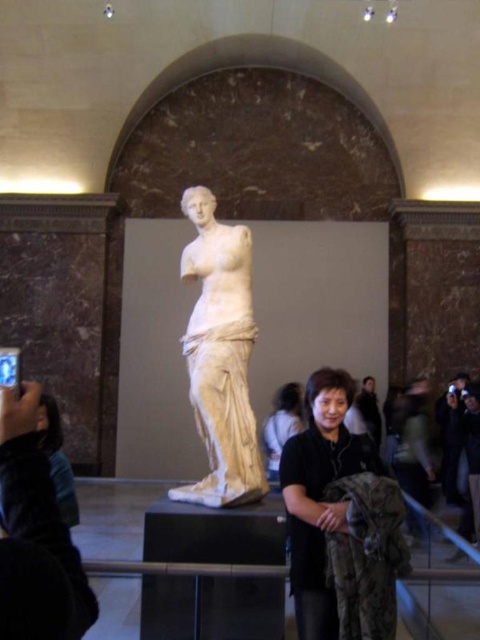
Which is below, dark green fabric at lower right or black matte jacket at center?

dark green fabric at lower right is below.

Is point (410, 406) positioned before point (360, 392)?

Yes, it is.

This screenshot has width=480, height=640. What do you see at coordinates (414, 444) in the screenshot? I see `dark green fabric at lower right` at bounding box center [414, 444].

The image size is (480, 640). In order to click on dark green fabric at lower right in this screenshot , I will do `click(414, 444)`.

Can you confirm if white marble statue at center is positioned to the right of matte black jacket at lower center?

In fact, white marble statue at center is to the left of matte black jacket at lower center.

Image resolution: width=480 pixels, height=640 pixels. Describe the element at coordinates (220, 356) in the screenshot. I see `white marble statue at center` at that location.

This screenshot has height=640, width=480. In order to click on white marble statue at center in this screenshot , I will do `click(220, 356)`.

The image size is (480, 640). Identify the location of white marble statue at center. pos(220,356).

Is point (228, 241) closer to camera compared to point (427, 506)?

Yes, it is in front of point (427, 506).

How much distance is there between white marble statue at center and dark green fabric at lower right?

white marble statue at center and dark green fabric at lower right are 62.00 feet apart from each other.

Does point (214, 228) lie in front of point (424, 464)?

Yes, point (214, 228) is closer to viewer.

Identify the location of white marble statue at center. The width and height of the screenshot is (480, 640). (220, 356).